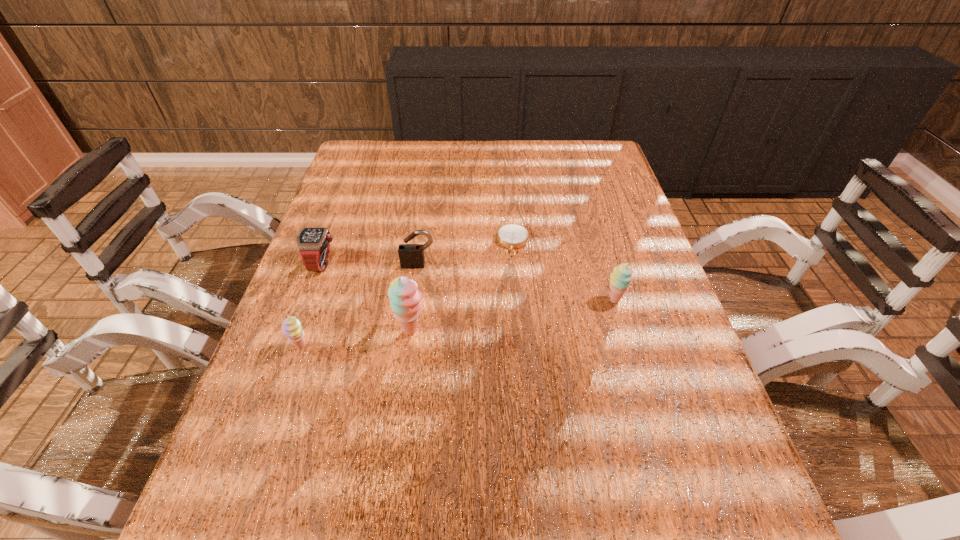
At what (x,y) coordinates should I click in order to perform the action: click on free space that satisfies the following two spatial constraints: 1. with the keyhole on the front of the padlock; 2. on the right side of the farthest sherbert. Please return your answer as a coordinate pair (x, y). Looking at the image, I should click on (414, 300).

I want to click on vacant region that satisfies the following two spatial constraints: 1. on the back side of the second tallest sherbert; 2. on the right side of the shortest sherbert, so click(x=317, y=300).